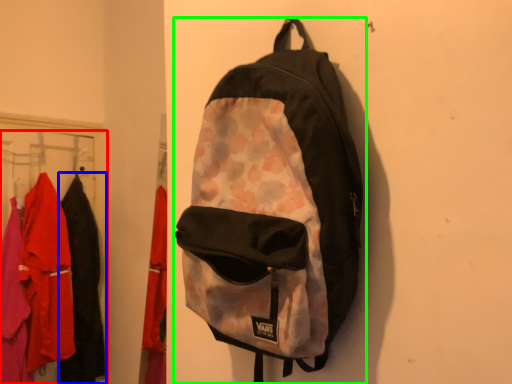
Question: Considering the real-world distances, which object is closest to closet (highlighted by a red box)? clothing (highlighted by a blue box) or backpack (highlighted by a green box).

Choices:
 (A) clothing
 (B) backpack

Answer: (A)